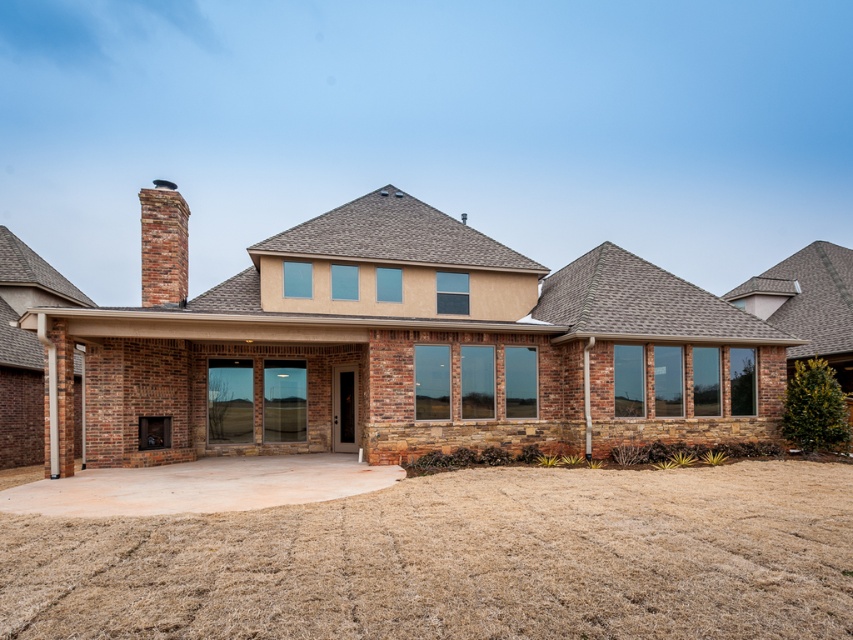
Is concrete at center shorter than smooth concrete driveway at center?

Indeed, concrete at center has a lesser height compared to smooth concrete driveway at center.

Which is above, concrete at center or smooth concrete driveway at center?

Positioned higher is concrete at center.

Is point (289, 586) more distant than point (289, 486)?

No.

You are a GUI agent. You are given a task and a screenshot of the screen. Output one action in this format:
    pyautogui.click(x=<x>, y=<y>)
    Task: Click on the concrete at center
    The image size is (853, 640).
    Given the screenshot: What is the action you would take?
    pyautogui.click(x=459, y=561)

Is concrete at center to the right of brick chimney at upper left from the viewer's perspective?

Correct, you'll find concrete at center to the right of brick chimney at upper left.

Between concrete at center and brick chimney at upper left, which one is positioned lower?

concrete at center is below.

Locate an element on the screen. concrete at center is located at coordinates (459, 561).

Does smooth concrete driveway at center have a greater width compared to brick chimney at upper left?

Yes.

Is smooth concrete driveway at center above brick chimney at upper left?

Incorrect, smooth concrete driveway at center is not positioned above brick chimney at upper left.

The width and height of the screenshot is (853, 640). Find the location of `smooth concrete driveway at center`. smooth concrete driveway at center is located at coordinates (200, 484).